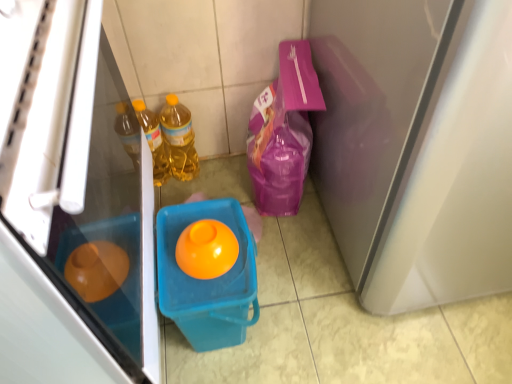
Question: Considering their positions, is matte white screen door at right located in front of or behind translucent yellow bottle at left, the second bottle viewed from the right?

Choices:
 (A) front
 (B) behind

Answer: (A)

Question: Is matte white screen door at right spatially inside translucent yellow bottle at left, the first bottle when ordered from left to right, or outside of it?

Choices:
 (A) inside
 (B) outside

Answer: (B)

Question: Estimate the real-world distances between objects in this image. Which object is farther from the orange glossy egg at center?

Choices:
 (A) translucent plastic bucket at center
 (B) matte plastic refrigerator at left
 (C) translucent yellow bottle at left, the first bottle when ordered from left to right
 (D) translucent yellow bottle at center, marked as the 2th bottle in a left-to-right arrangement
 (E) matte white screen door at right

Answer: (D)

Question: Estimate the real-world distances between objects in this image. Which object is closer to the translucent plastic bucket at center?

Choices:
 (A) translucent yellow bottle at center, marked as the 2th bottle in a left-to-right arrangement
 (B) translucent yellow bottle at left, the second bottle viewed from the right
 (C) matte plastic refrigerator at left
 (D) orange glossy egg at center
 (E) matte white screen door at right

Answer: (D)